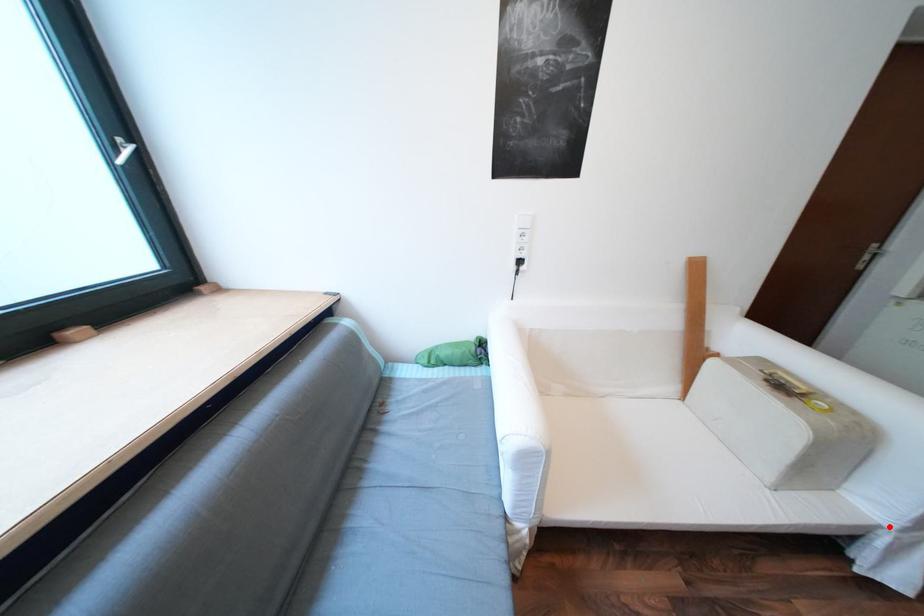
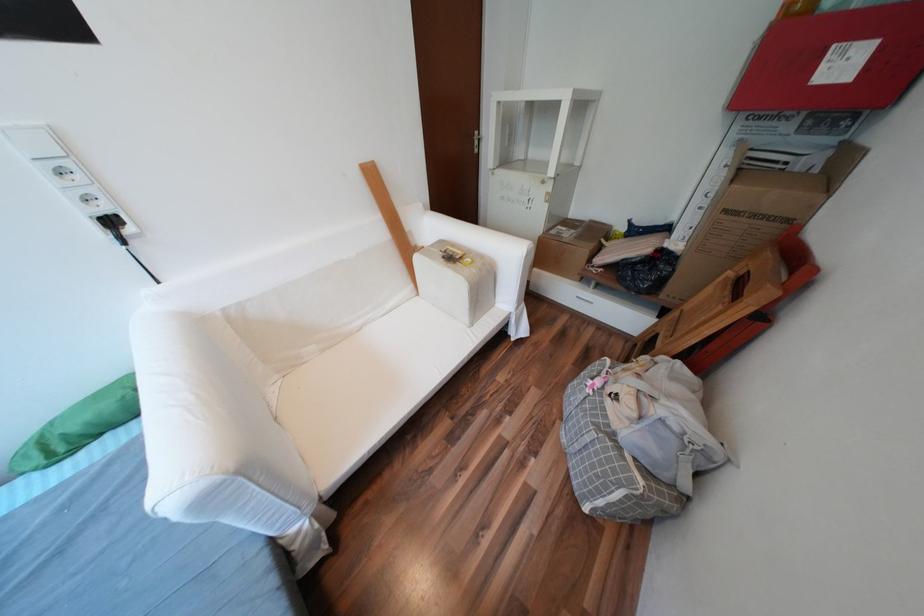
Where in the second image is the point corresponding to the highlighted location from the first image?

(519, 313)